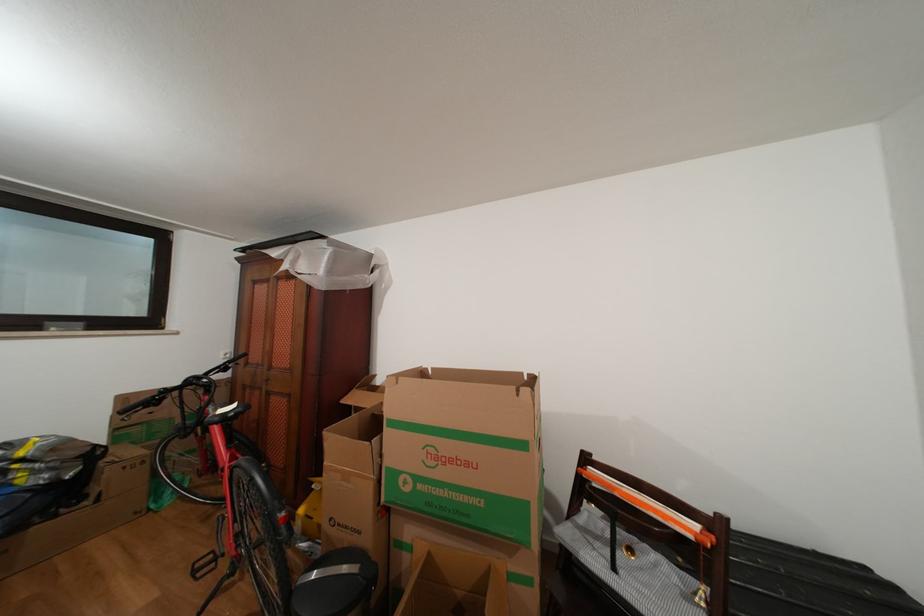
Find where to pull the dark window handle. Please return your answer as a coordinate pair (x, y).

(63, 328)